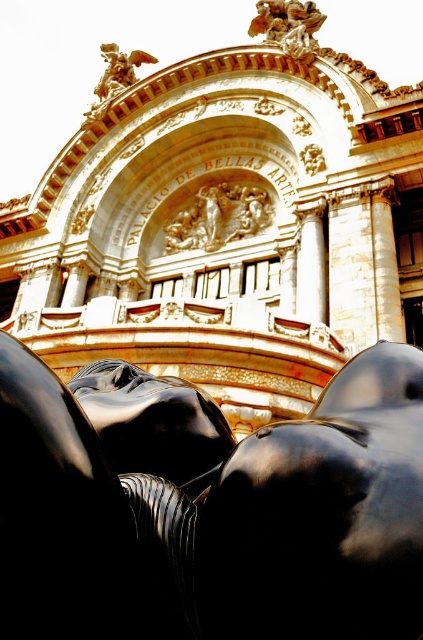
You are an art student standing in front of the Palacio de Bellas Artes. You see the black polished statue at lower center and the black glossy statue at center. Which statue is located to the right of the other?

The black polished statue at lower center is positioned on the right side of the black glossy statue at center.